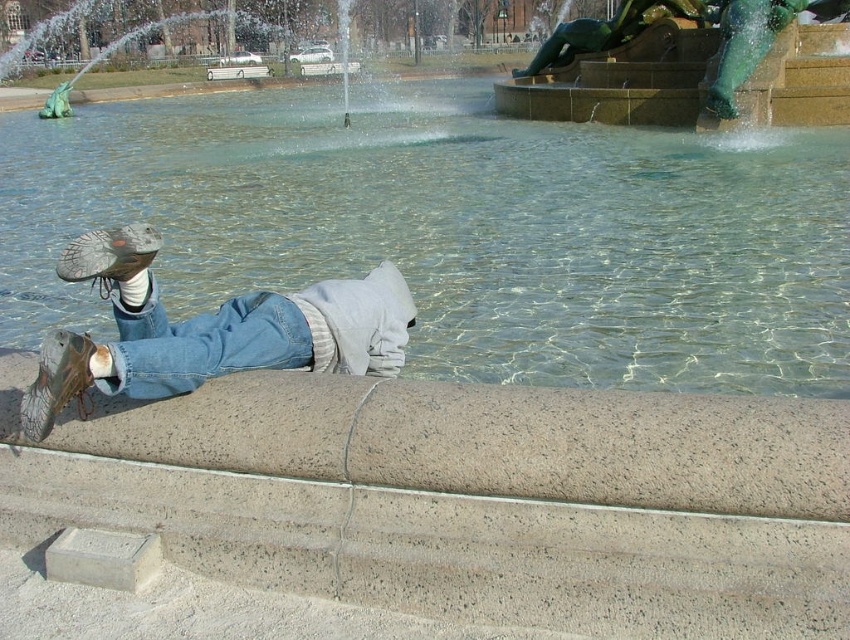
Question: Based on their relative distances, which object is nearer to the clear glass water at lower left?

Choices:
 (A) green patina metal statue at upper right
 (B) leather shoe at lower left
 (C) denim at lower center

Answer: (A)

Question: Can you confirm if clear glass water at lower left is bigger than denim at lower center?

Choices:
 (A) no
 (B) yes

Answer: (B)

Question: Can you confirm if leather shoe at lower left is positioned below denim at lower center?

Choices:
 (A) no
 (B) yes

Answer: (A)

Question: Considering the relative positions of clear glass water at lower left and leather shoe at lower left in the image provided, where is clear glass water at lower left located with respect to leather shoe at lower left?

Choices:
 (A) left
 (B) right

Answer: (B)

Question: Which point is closer to the camera taking this photo?

Choices:
 (A) (230, 337)
 (B) (612, 256)
 (C) (731, 20)
 (D) (132, 332)

Answer: (D)

Question: Which object is farther from the camera taking this photo?

Choices:
 (A) clear glass water at lower left
 (B) leather shoe at lower left
 (C) denim at lower center

Answer: (A)